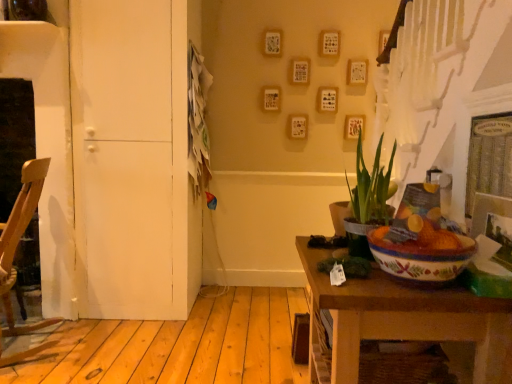
Find the location of a particular element. Image resolution: width=512 pixels, height=384 pixels. vacant area located to the right-hand side of wooden chair at left is located at coordinates (98, 349).